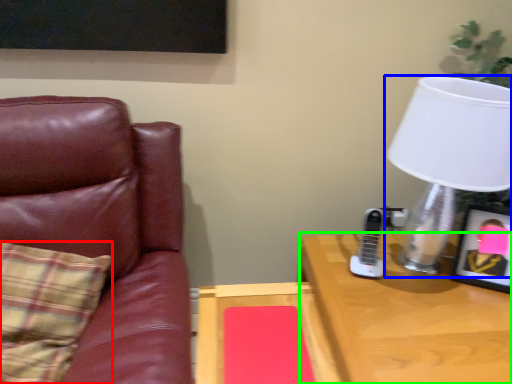
Question: Estimate the real-world distances between objects in this image. Which object is closer to pillow (highlighted by a red box), lamp (highlighted by a blue box) or desk (highlighted by a green box)?

Choices:
 (A) lamp
 (B) desk

Answer: (B)